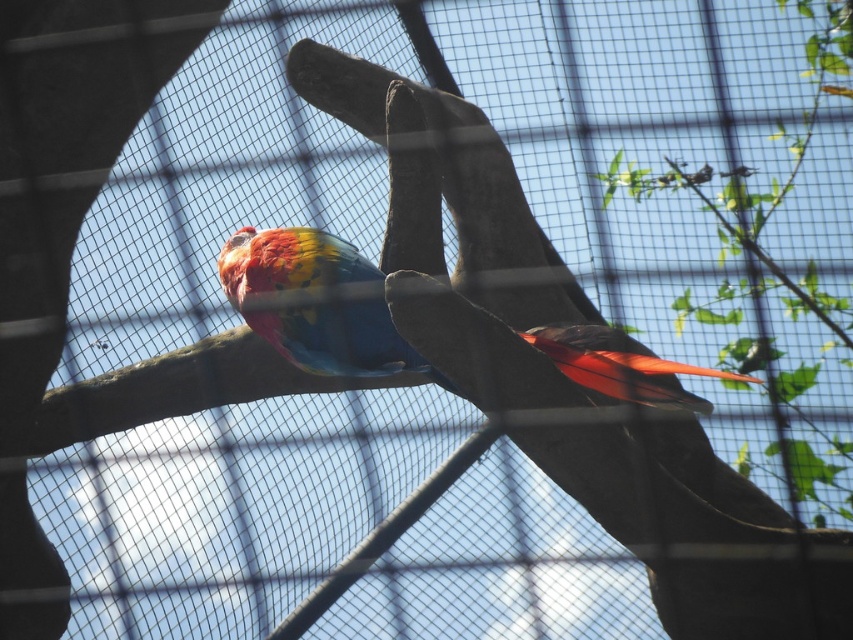
Who is shorter, shiny multicolored parrot at center or shiny red feathers at right?

With less height is shiny red feathers at right.

Does point (363, 360) come closer to viewer compared to point (534, 339)?

No.

Find the location of a particular element. The width and height of the screenshot is (853, 640). shiny multicolored parrot at center is located at coordinates (314, 304).

Is shiny red feathers at right below shiny metallic bird at upper center?

Yes.

Identify the location of shiny red feathers at right. (624, 368).

Between point (376, 333) and point (753, 172), which one is positioned behind?

Positioned behind is point (753, 172).

The height and width of the screenshot is (640, 853). What do you see at coordinates (314, 304) in the screenshot?
I see `shiny multicolored parrot at center` at bounding box center [314, 304].

Is point (403, 360) positioned after point (738, 176)?

That is False.

Identify the location of shiny multicolored parrot at center. The width and height of the screenshot is (853, 640). (314, 304).